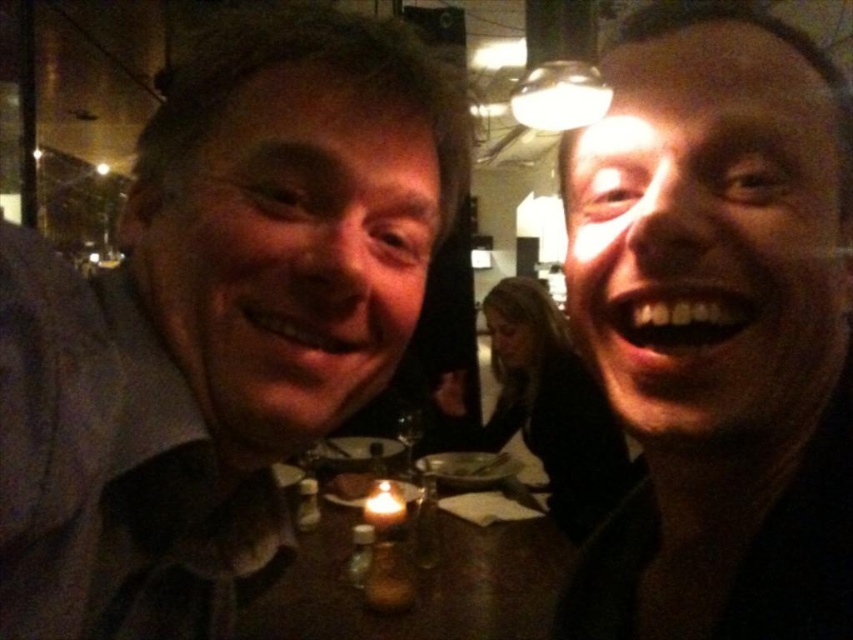
Between matte black shirt at left and matte black face at center, which one appears on the left side from the viewer's perspective?

From the viewer's perspective, matte black shirt at left appears more on the left side.

Is matte black shirt at left to the left of matte black face at center from the viewer's perspective?

Correct, you'll find matte black shirt at left to the left of matte black face at center.

Find the location of `matte black shirt at left`. matte black shirt at left is located at coordinates (218, 321).

You are a GUI agent. You are given a task and a screenshot of the screen. Output one action in this format:
    pyautogui.click(x=<x>, y=<y>)
    Task: Click on the matte black shirt at left
    
    Given the screenshot: What is the action you would take?
    pyautogui.click(x=218, y=321)

Is matte black shirt at left smaller than wooden table at center?

Actually, matte black shirt at left might be larger than wooden table at center.

Is point (329, 337) positioned behind point (521, 625)?

That is False.

Identify the location of matte black shirt at left. (218, 321).

Identify the location of matte black shirt at left. (218, 321).

Who is more forward, (306, 80) or (376, 486)?

Point (306, 80)

Identify the location of matte black shirt at left. (218, 321).

The image size is (853, 640). What are the coordinates of `matte black shirt at left` in the screenshot? It's located at (218, 321).